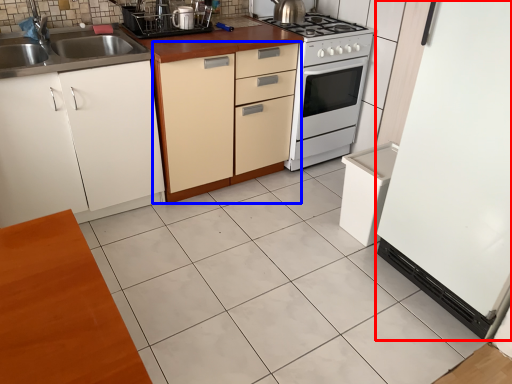
Question: Among these objects, which one is farthest to the camera, appliance (highlighted by a red box) or cabinetry (highlighted by a blue box)?

Choices:
 (A) appliance
 (B) cabinetry

Answer: (B)